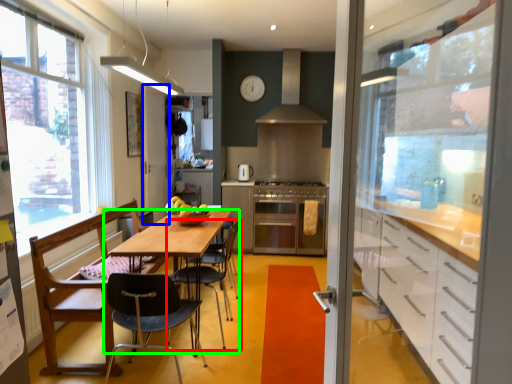
Question: Based on their relative distances, which object is nearer to chair (highlighted by a red box)? Choose from screen door (highlighted by a blue box) and table (highlighted by a green box).

Choices:
 (A) screen door
 (B) table

Answer: (B)